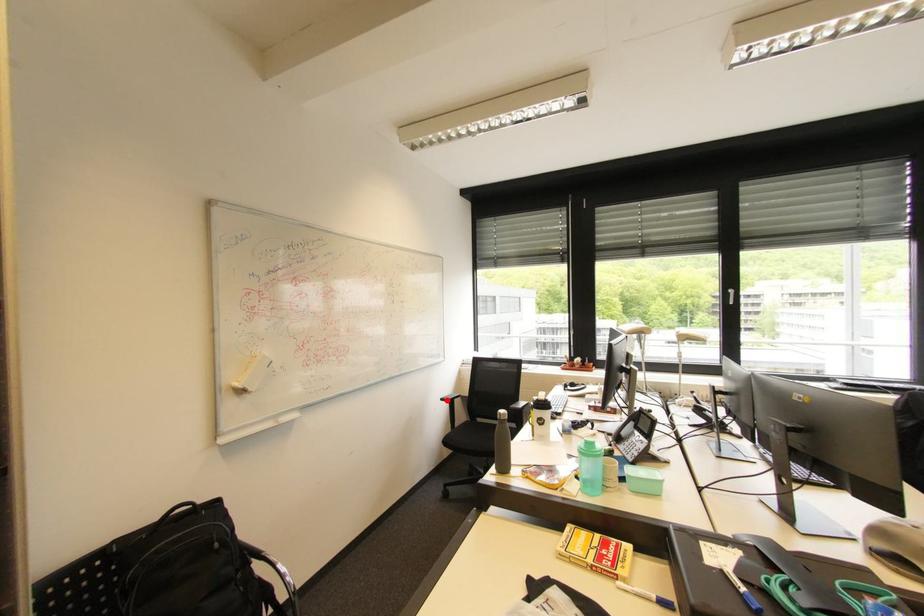
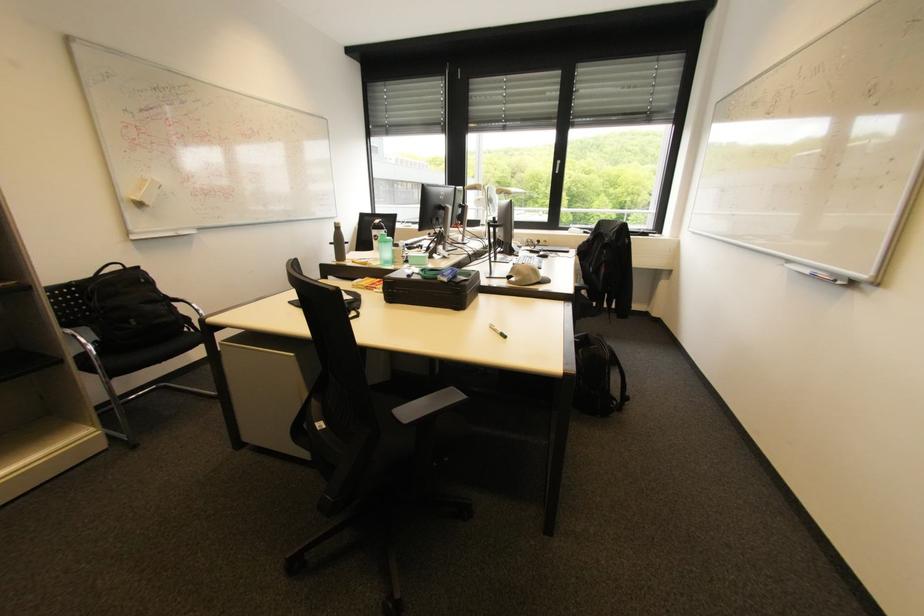
The point at the highlighted location is marked in the first image. Where is the corresponding point in the second image?

(335, 244)